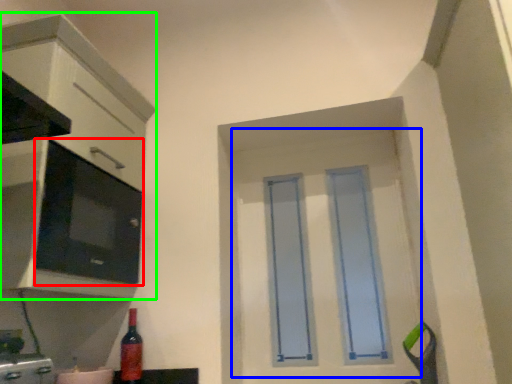
Question: Based on their relative distances, which object is nearer to appliance (highlighted by a red box)? Choose from door (highlighted by a blue box) and cabinetry (highlighted by a green box).

Choices:
 (A) door
 (B) cabinetry

Answer: (B)